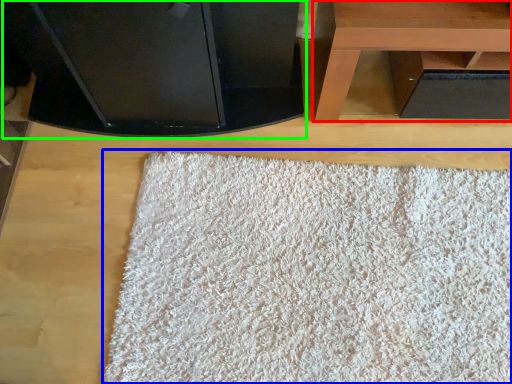
Question: Considering the real-world distances, which object is closest to table (highlighted by a red box)? mat (highlighted by a blue box) or furniture (highlighted by a green box).

Choices:
 (A) mat
 (B) furniture

Answer: (B)